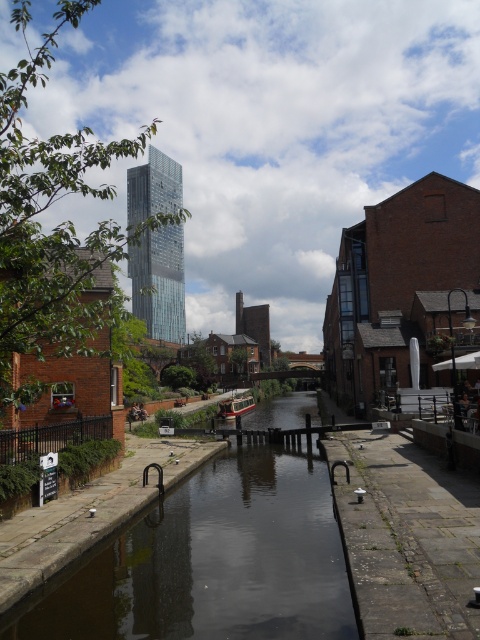
Question: Can you confirm if dark reflective water at center is smaller than wooden boat at center?

Choices:
 (A) no
 (B) yes

Answer: (A)

Question: Does dark reflective water at center appear under wooden boat at center?

Choices:
 (A) yes
 (B) no

Answer: (B)

Question: Which of the following is the closest to the observer?

Choices:
 (A) wooden boat at center
 (B) dark reflective water at center

Answer: (B)

Question: Which of the following is the closest to the observer?

Choices:
 (A) (274, 416)
 (B) (222, 404)

Answer: (B)

Question: Is dark reflective water at center to the left of wooden boat at center from the viewer's perspective?

Choices:
 (A) no
 (B) yes

Answer: (A)